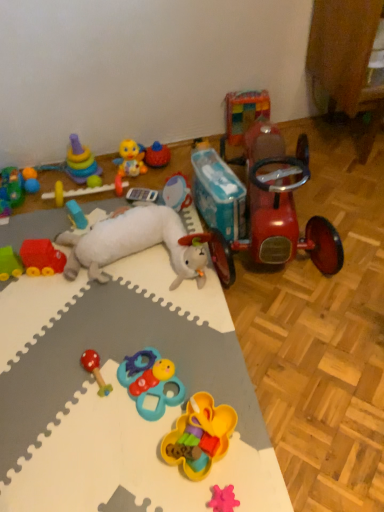
The height and width of the screenshot is (512, 384). What are the coordinates of `free space behind pink rubber bear at lower center, the 3th toy when ordered from right to left` in the screenshot? It's located at (220, 438).